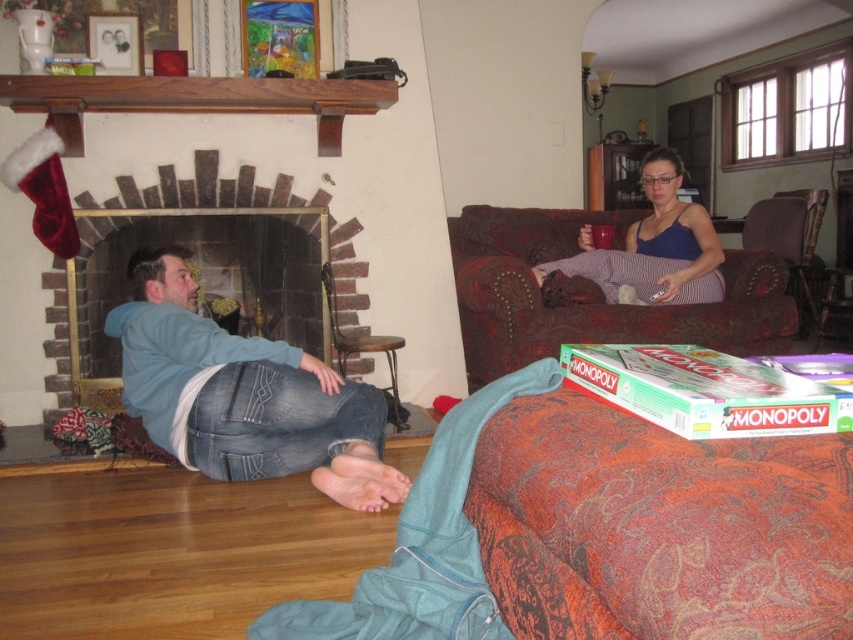
Question: Which of these objects is positioned closest to the blue denim jeans at lower left?

Choices:
 (A) velvet-like brown couch at upper right
 (B) dark brown leather armchair at right
 (C) brick fireplace at left

Answer: (C)

Question: Can you confirm if blue denim jeans at lower left is positioned above blue fabric dress at center?

Choices:
 (A) no
 (B) yes

Answer: (A)

Question: Can you confirm if blue denim jeans at lower left is wider than blue fabric dress at center?

Choices:
 (A) yes
 (B) no

Answer: (A)

Question: Which point is farther to the camera?

Choices:
 (A) (701, 262)
 (B) (808, 244)

Answer: (B)

Question: Which object appears closest to the camera in this image?

Choices:
 (A) blue fabric dress at center
 (B) blue denim jeans at lower left

Answer: (B)

Question: Does wooden seat at lower left have a larger size compared to dark brown leather armchair at right?

Choices:
 (A) no
 (B) yes

Answer: (A)